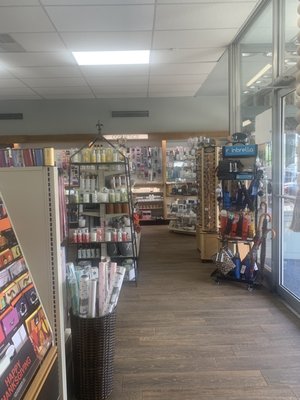
At what (x,y) coordinates should I click in order to perform the action: click on basket. Please return your answer as a coordinate pair (x, y). The image size is (300, 400). Looking at the image, I should click on (93, 353).